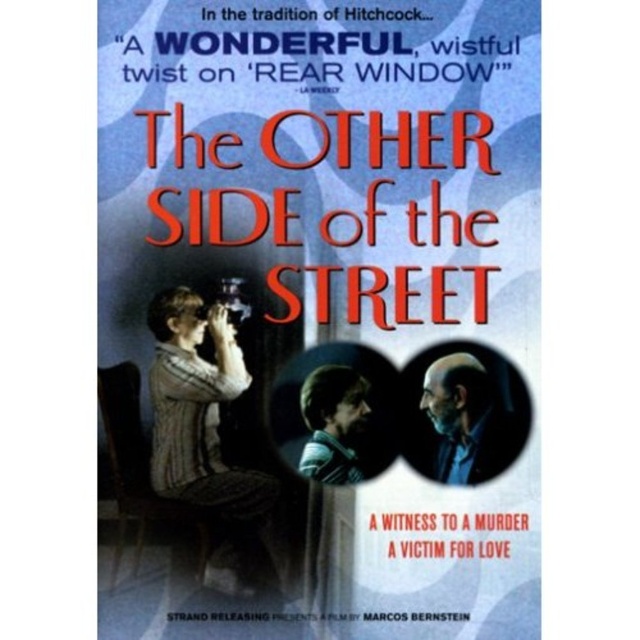
From the picture: Can you confirm if matte black camera at upper left is thinner than gray hair at center?

No, matte black camera at upper left is not thinner than gray hair at center.

Who is lower down, matte black camera at upper left or gray hair at center?

gray hair at center

I want to click on matte black camera at upper left, so click(x=328, y=305).

You are a GUI agent. You are given a task and a screenshot of the screen. Output one action in this format:
    pyautogui.click(x=<x>, y=<y>)
    Task: Click on the matte black camera at upper left
    
    Given the screenshot: What is the action you would take?
    pyautogui.click(x=328, y=305)

Does knitted sweater at center have a lesser height compared to smooth brown hair at center?

Incorrect, knitted sweater at center's height does not fall short of smooth brown hair at center's.

Is knitted sweater at center thinner than smooth brown hair at center?

Incorrect, knitted sweater at center's width is not less than smooth brown hair at center's.

Locate an element on the screen. The width and height of the screenshot is (640, 640). knitted sweater at center is located at coordinates (209, 436).

The image size is (640, 640). In order to click on knitted sweater at center in this screenshot , I will do `click(209, 436)`.

Does matte black camera at upper left have a larger size compared to knitted sweater at center?

Correct, matte black camera at upper left is larger in size than knitted sweater at center.

Who is shorter, matte black camera at upper left or knitted sweater at center?

knitted sweater at center is shorter.

Which is in front, point (428, 561) or point (200, 499)?

Positioned in front is point (428, 561).

Identify the location of matte black camera at upper left. The width and height of the screenshot is (640, 640). (328, 305).